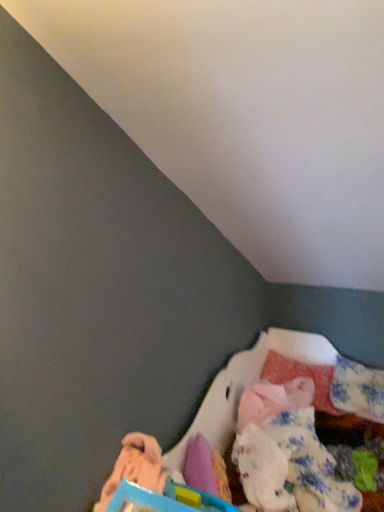
Image resolution: width=384 pixels, height=512 pixels. What do you see at coordinates (269, 431) in the screenshot?
I see `blue plastic toy at lower right` at bounding box center [269, 431].

Measure the distance between point (305,366) and camera.

The distance of point (305,366) from camera is 2.61 meters.

The image size is (384, 512). What are the coordinates of `blue plastic toy at lower right` in the screenshot? It's located at click(x=269, y=431).

I want to click on blue plastic toy at lower right, so click(x=269, y=431).